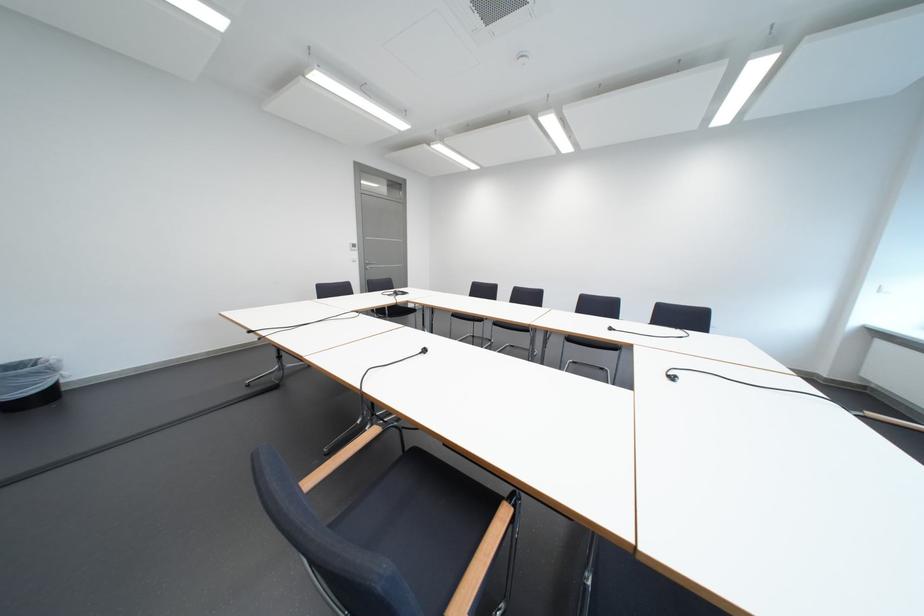
You are a GUI agent. You are given a task and a screenshot of the screen. Output one action in this format:
    pyautogui.click(x=<x>, y=<y>)
    Task: Click on the vertical door handle
    The image size is (924, 616).
    Given the screenshot: What is the action you would take?
    pyautogui.click(x=369, y=264)